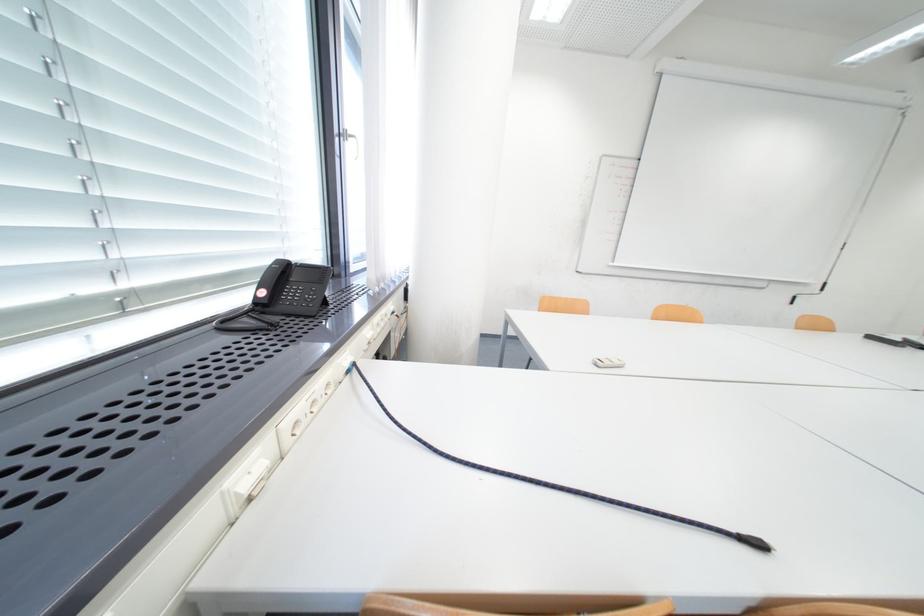
This screenshot has height=616, width=924. What do you see at coordinates (271, 282) in the screenshot?
I see `the black phone handset` at bounding box center [271, 282].